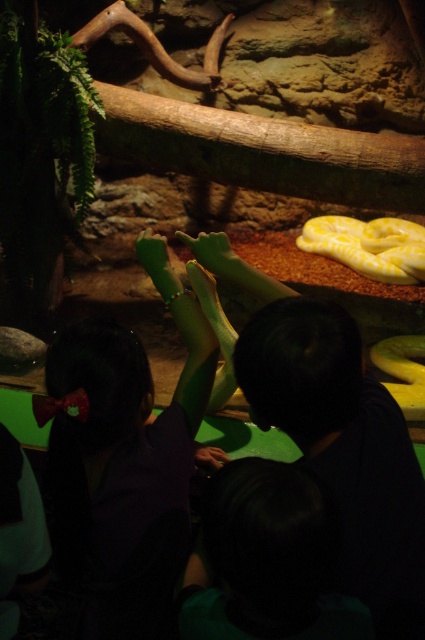
You are a zookeeper trying to place a new sign between the two points, point (x=354, y=234) and point (x=413, y=342). Which point is closer to the camera where you should start placing the sign first?

Point (x=354, y=234) is closer to the camera than point (x=413, y=342), so you should start placing the sign near point (x=354, y=234) first.

You are a zookeeper preparing to clean the exhibit. You need to reach the dark purple shirt at center to retrieve a tool. However, the yellow matte snake at upper center is in your way. Can you safely move past the snake to access the shirt?

The dark purple shirt at center is below the yellow matte snake at upper center, so you can safely move past the snake to access the shirt since it is positioned lower than the snake.